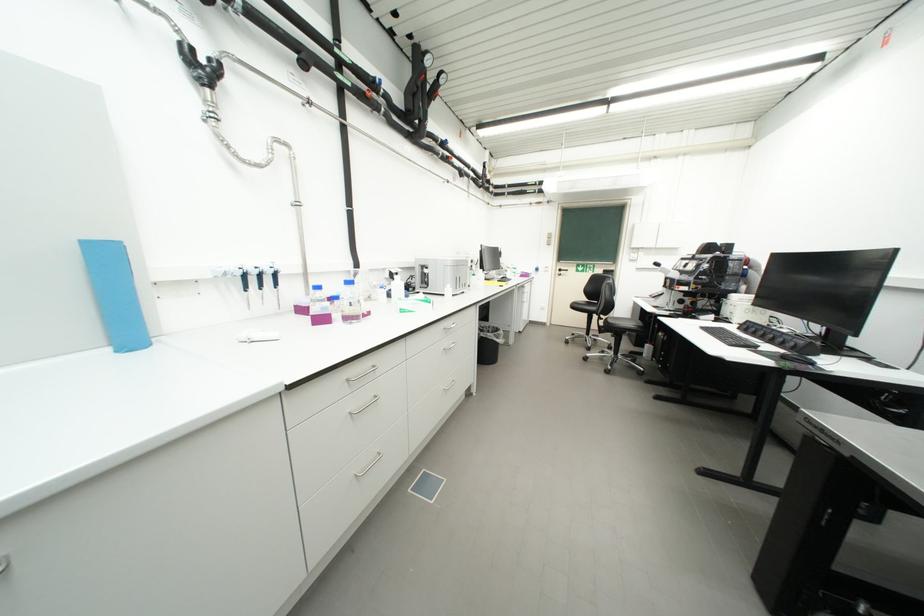
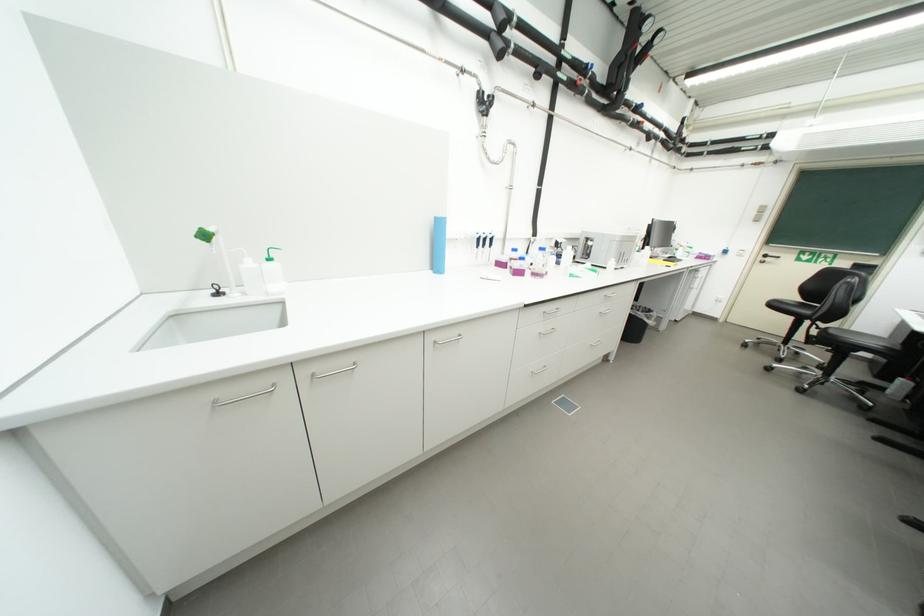
Where in the second image is the point corresponding to pixel 582 308 from the first image?

(783, 307)